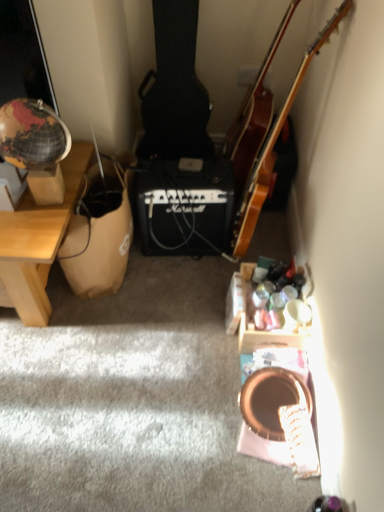
Locate an element on the screen. free spot below wooden acoustic guitar at upper right (from a real-world perspective) is located at coordinates (271, 248).